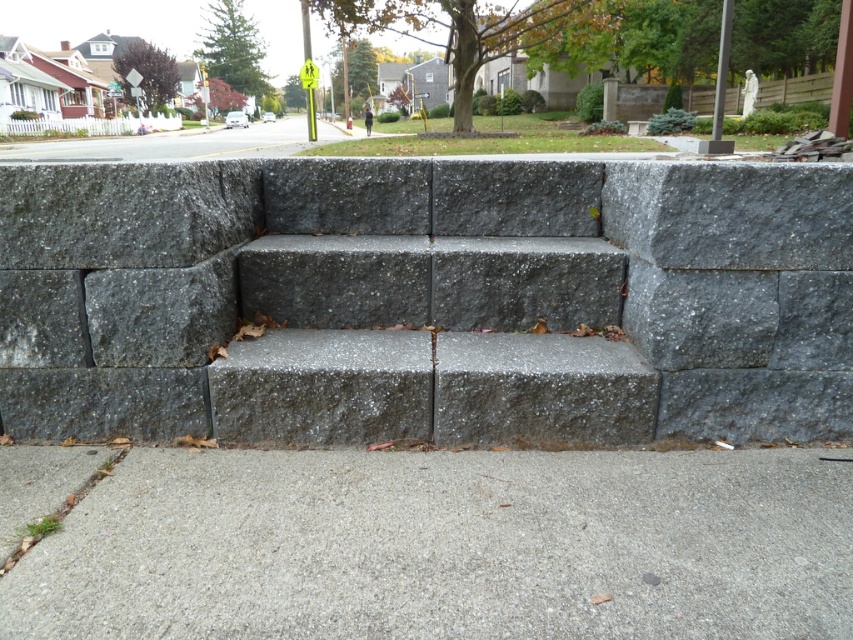
Question: Does gray concrete stairs at center come behind gray concrete pavement at lower center?

Choices:
 (A) yes
 (B) no

Answer: (A)

Question: Which of the following is the closest to the observer?

Choices:
 (A) tap(677, 192)
 (B) tap(125, 522)

Answer: (B)

Question: Is gray concrete stairs at center bigger than gray concrete pavement at lower center?

Choices:
 (A) no
 (B) yes

Answer: (B)

Question: Is gray concrete stairs at center bigger than gray concrete pavement at lower center?

Choices:
 (A) yes
 (B) no

Answer: (A)